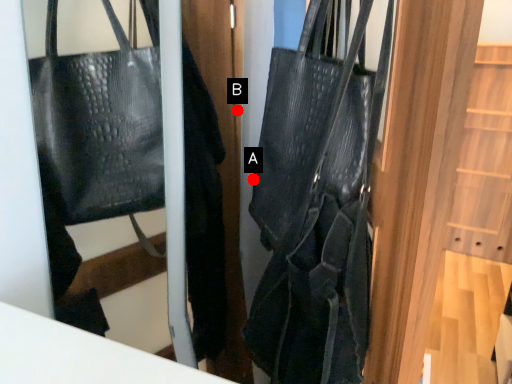
Question: Two points are circled on the image, labeled by A and B beside each circle. Which point appears closest to the camera in this image?

Choices:
 (A) A is closer
 (B) B is closer

Answer: (A)